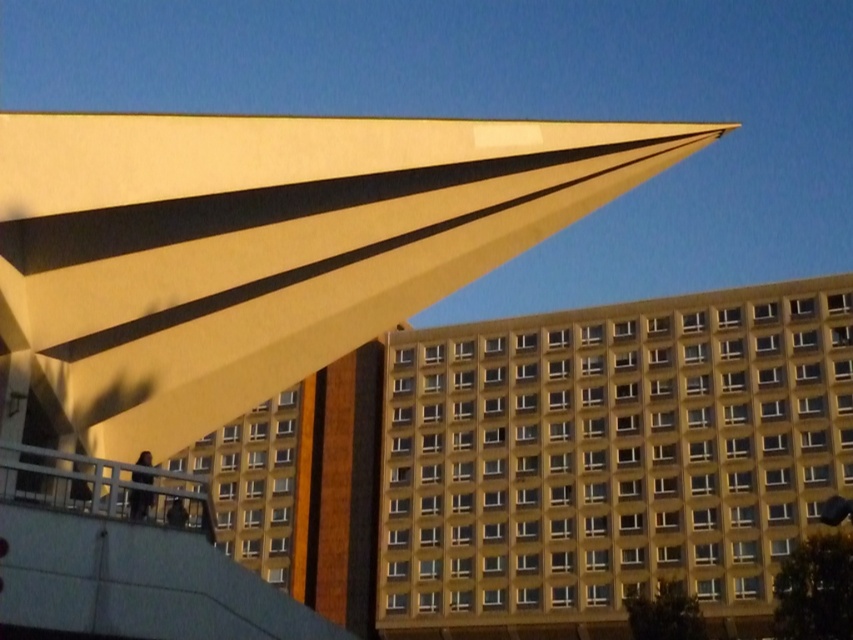
Does brown brick building at center appear under yellowish concrete building at center?

No, brown brick building at center is not below yellowish concrete building at center.

Can you confirm if brown brick building at center is thinner than yellowish concrete building at center?

No, brown brick building at center is not thinner than yellowish concrete building at center.

This screenshot has width=853, height=640. I want to click on brown brick building at center, so click(x=608, y=460).

Locate an element on the screen. The height and width of the screenshot is (640, 853). brown brick building at center is located at coordinates (608, 460).